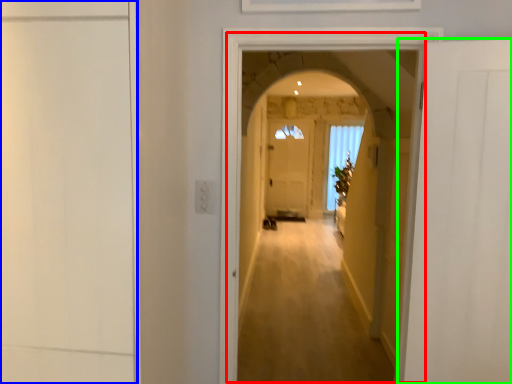
Question: Which is farther away from corridor (highlighted by a red box)? door (highlighted by a blue box) or door (highlighted by a green box)?

Choices:
 (A) door
 (B) door

Answer: (A)